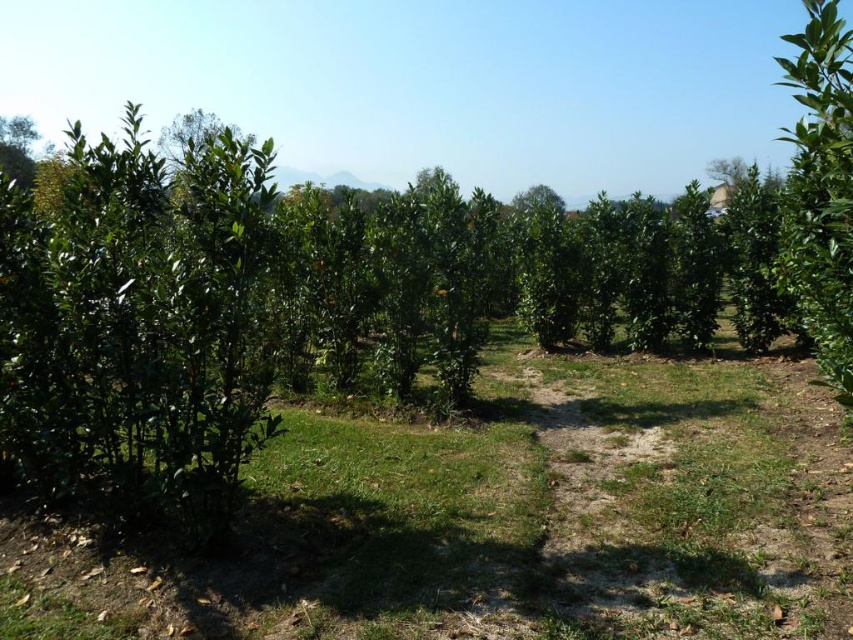
Question: Is green grass at center below green leafy tree at upper right?

Choices:
 (A) no
 (B) yes

Answer: (B)

Question: Which point is farther to the camera?

Choices:
 (A) green grass at center
 (B) green leafy tree at upper right

Answer: (B)

Question: Is green grass at center smaller than green leafy tree at upper right?

Choices:
 (A) yes
 (B) no

Answer: (A)

Question: Which point is closer to the camera taking this photo?

Choices:
 (A) (436, 618)
 (B) (732, 156)

Answer: (A)

Question: Can you confirm if green grass at center is positioned above green leafy tree at upper right?

Choices:
 (A) no
 (B) yes

Answer: (A)